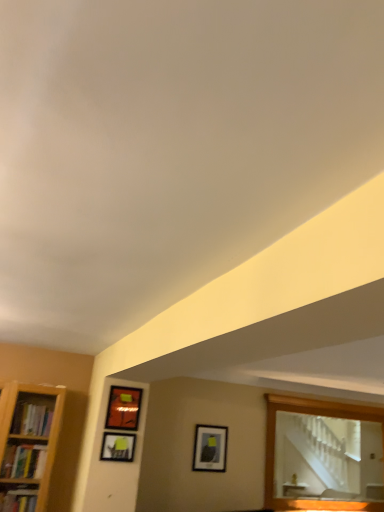
Question: Is matte black picture frame at upper center, which appears as the third picture frame when viewed from the back, positioned far away from matte orange picture frame at upper left, the second picture frame positioned from the front?

Choices:
 (A) yes
 (B) no

Answer: (B)

Question: Can you confirm if matte black picture frame at upper center, which ranks as the first picture frame in left-to-right order, is bigger than matte orange picture frame at upper left, the second picture frame viewed from the left?

Choices:
 (A) no
 (B) yes

Answer: (A)

Question: Can we say matte black picture frame at upper center, positioned as the second picture frame in bottom-to-top order, lies outside matte orange picture frame at upper left, the second picture frame from the right?

Choices:
 (A) no
 (B) yes

Answer: (B)

Question: Is matte black picture frame at upper center, positioned as the second picture frame in bottom-to-top order, with matte orange picture frame at upper left, the second picture frame from the right?

Choices:
 (A) yes
 (B) no

Answer: (B)

Question: Considering the relative sizes of matte black picture frame at upper center, which appears as the third picture frame when viewed from the back, and matte orange picture frame at upper left, marked as the first picture frame in a top-to-bottom arrangement, in the image provided, is matte black picture frame at upper center, which appears as the third picture frame when viewed from the back, thinner than matte orange picture frame at upper left, marked as the first picture frame in a top-to-bottom arrangement,?

Choices:
 (A) yes
 (B) no

Answer: (A)

Question: In the image, is matte orange picture frame at upper left, the 2th picture frame positioned from the back, positioned in front of or behind matte black picture frame at center, the 3th picture frame viewed from the top?

Choices:
 (A) front
 (B) behind

Answer: (A)

Question: Considering the relative positions of matte orange picture frame at upper left, which is the 3th picture frame in bottom-to-top order, and matte black picture frame at center, which is the 3th picture frame from left to right, in the image provided, is matte orange picture frame at upper left, which is the 3th picture frame in bottom-to-top order, to the left or to the right of matte black picture frame at center, which is the 3th picture frame from left to right,?

Choices:
 (A) right
 (B) left

Answer: (B)

Question: Looking at their shapes, would you say matte orange picture frame at upper left, the second picture frame positioned from the front, is wider or thinner than matte black picture frame at center, which is counted as the first picture frame, starting from the bottom?

Choices:
 (A) thin
 (B) wide

Answer: (A)

Question: In terms of height, does matte orange picture frame at upper left, the 2th picture frame positioned from the back, look taller or shorter compared to matte black picture frame at center, which is the first picture frame from right to left?

Choices:
 (A) tall
 (B) short

Answer: (B)

Question: From the image's perspective, relative to matte orange picture frame at upper left, marked as the first picture frame in a top-to-bottom arrangement, is wooden mirror at upper right above or below?

Choices:
 (A) above
 (B) below

Answer: (B)

Question: Is wooden mirror at upper right spatially inside matte orange picture frame at upper left, the second picture frame positioned from the front, or outside of it?

Choices:
 (A) inside
 (B) outside

Answer: (B)

Question: Would you say wooden mirror at upper right is to the left or to the right of matte orange picture frame at upper left, the second picture frame viewed from the left, in the picture?

Choices:
 (A) left
 (B) right

Answer: (B)

Question: Is wooden mirror at upper right bigger or smaller than matte orange picture frame at upper left, the second picture frame viewed from the left?

Choices:
 (A) big
 (B) small

Answer: (A)

Question: From the image's perspective, relative to matte orange picture frame at upper left, the second picture frame viewed from the left, is matte black picture frame at upper center, positioned as the second picture frame in bottom-to-top order, above or below?

Choices:
 (A) below
 (B) above

Answer: (A)

Question: Based on their sizes in the image, would you say matte black picture frame at upper center, positioned as the second picture frame in top-to-bottom order, is bigger or smaller than matte orange picture frame at upper left, the second picture frame from the right?

Choices:
 (A) small
 (B) big

Answer: (A)